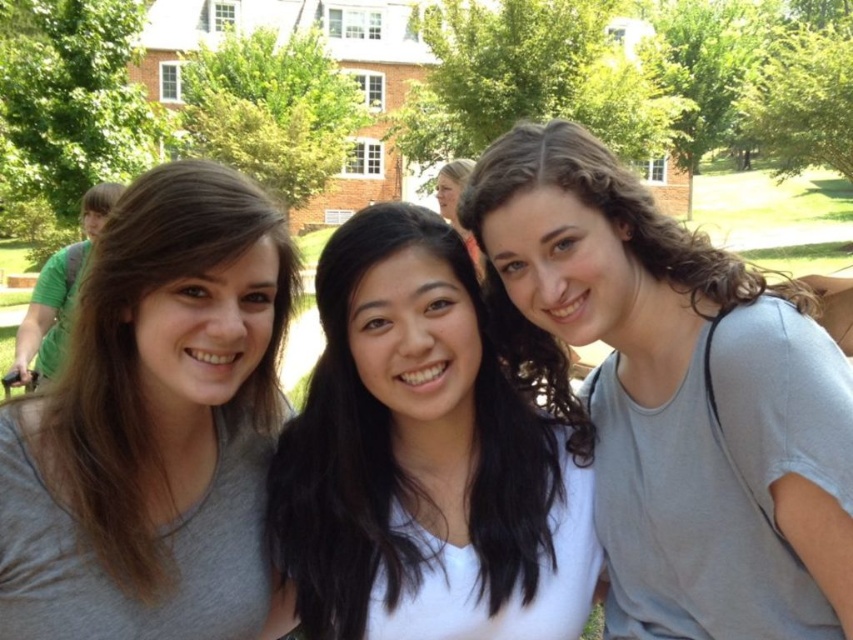
Which is more to the left, matte gray shirt at left or white matte shirt at center?

Positioned to the left is matte gray shirt at left.

Does matte gray shirt at left appear over white matte shirt at center?

Yes, matte gray shirt at left is above white matte shirt at center.

Measure the distance between point (146, 625) and camera.

Point (146, 625) is 10.03 meters from camera.

In order to click on matte gray shirt at left in this screenshot , I will do `click(154, 424)`.

Is matte gray shirt at center positioned in front of white matte shirt at center?

Yes, matte gray shirt at center is in front of white matte shirt at center.

Between point (769, 301) and point (437, 417), which one is positioned behind?

Point (437, 417)

Where is `matte gray shirt at center`? This screenshot has height=640, width=853. matte gray shirt at center is located at coordinates (679, 397).

Is matte gray shirt at center smaller than matte gray shirt at left?

Indeed, matte gray shirt at center has a smaller size compared to matte gray shirt at left.

Is point (526, 316) behind point (155, 173)?

That is True.

Locate an element on the screen. The height and width of the screenshot is (640, 853). matte gray shirt at center is located at coordinates (679, 397).